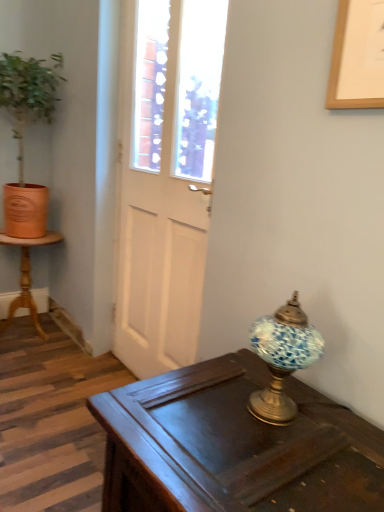
At what (x,y) coordinates should I click in order to perform the action: click on free space above dark wood desk at center (from a real-world perspective). Please return your answer as a coordinate pair (x, y). The image size is (384, 512). Looking at the image, I should click on (257, 435).